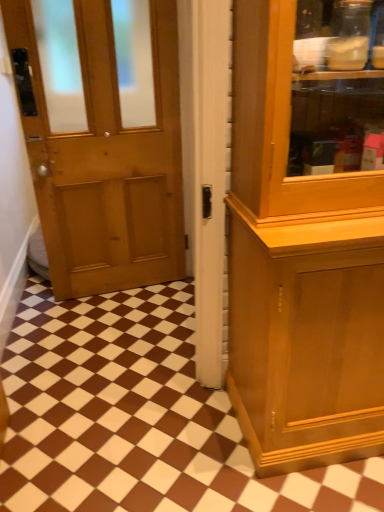
The image size is (384, 512). Identify the location of free space in front of matte wood door at center. (104, 451).